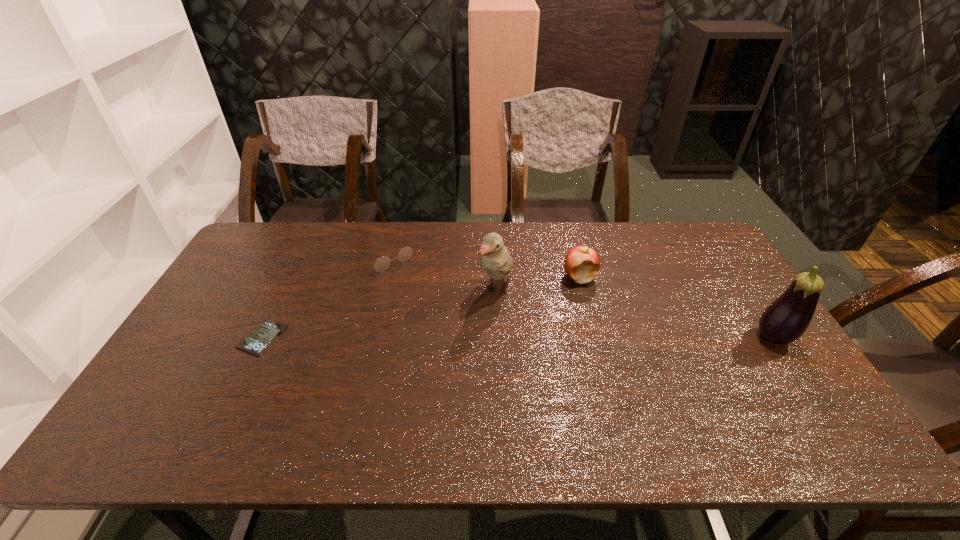
At what (x,y) coordinates should I click in order to perform the action: click on object that ranks as the fourth closest to the shortest object. Please return your answer as a coordinate pair (x, y). Looking at the image, I should click on (785, 320).

You are a GUI agent. You are given a task and a screenshot of the screen. Output one action in this format:
    pyautogui.click(x=<x>, y=<y>)
    Task: Click on the vacant space that satisfies the following two spatial constraints: 1. on the front side of the fourth object from right to left; 2. on the left side of the fourth object from left to right
    The width and height of the screenshot is (960, 540).
    Given the screenshot: What is the action you would take?
    pyautogui.click(x=377, y=276)

This screenshot has height=540, width=960. What are the coordinates of `vacant space that satisfies the following two spatial constraints: 1. on the front side of the bird; 2. on the left side of the eggplant` in the screenshot? It's located at (499, 337).

Locate an element on the screen. This screenshot has height=540, width=960. free spot that satisfies the following two spatial constraints: 1. on the front side of the third object from left to right; 2. on the left side of the spectacles is located at coordinates (374, 290).

The image size is (960, 540). I want to click on vacant space that satisfies the following two spatial constraints: 1. on the front side of the second object from left to right; 2. on the right side of the third object from right to left, so click(x=374, y=290).

Where is `vacant space that satisfies the following two spatial constraints: 1. on the front side of the apple; 2. on the right side of the second shortest object`? Image resolution: width=960 pixels, height=540 pixels. vacant space that satisfies the following two spatial constraints: 1. on the front side of the apple; 2. on the right side of the second shortest object is located at coordinates (377, 276).